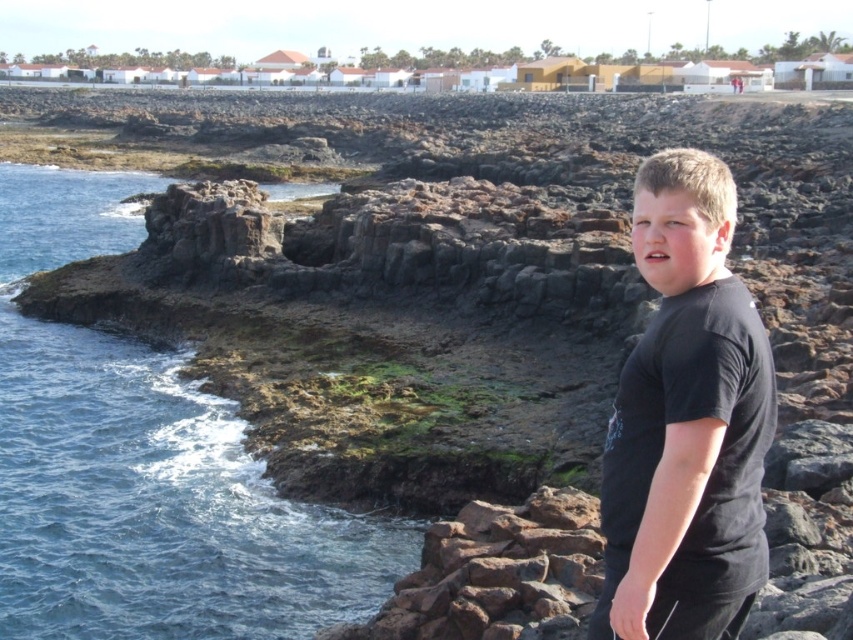
Which is in front, point (108, 545) or point (659, 230)?

Point (659, 230) is more forward.

I want to click on blue water at left, so click(146, 467).

At what (x,y) coordinates should I click in order to perform the action: click on blue water at left. Please return your answer as a coordinate pair (x, y). Looking at the image, I should click on (146, 467).